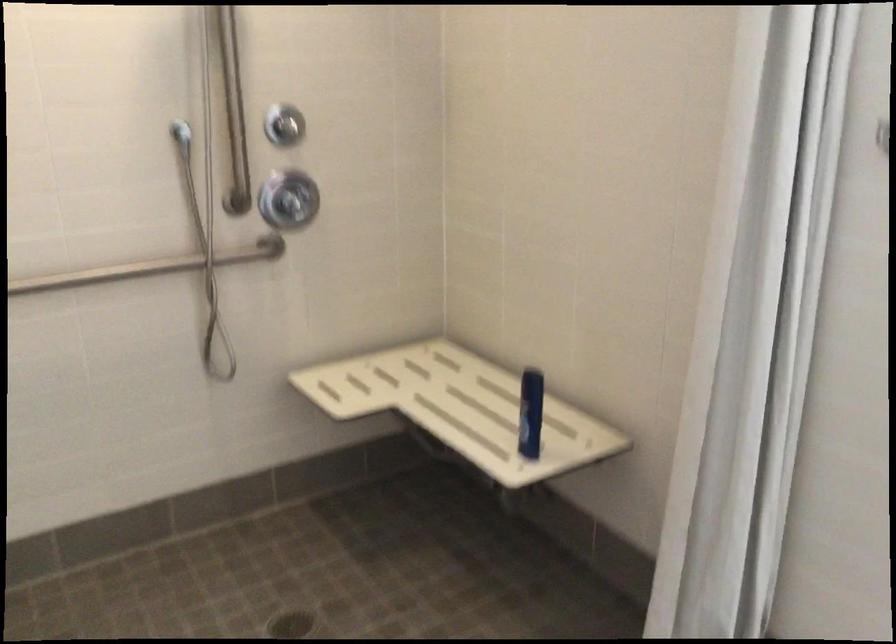
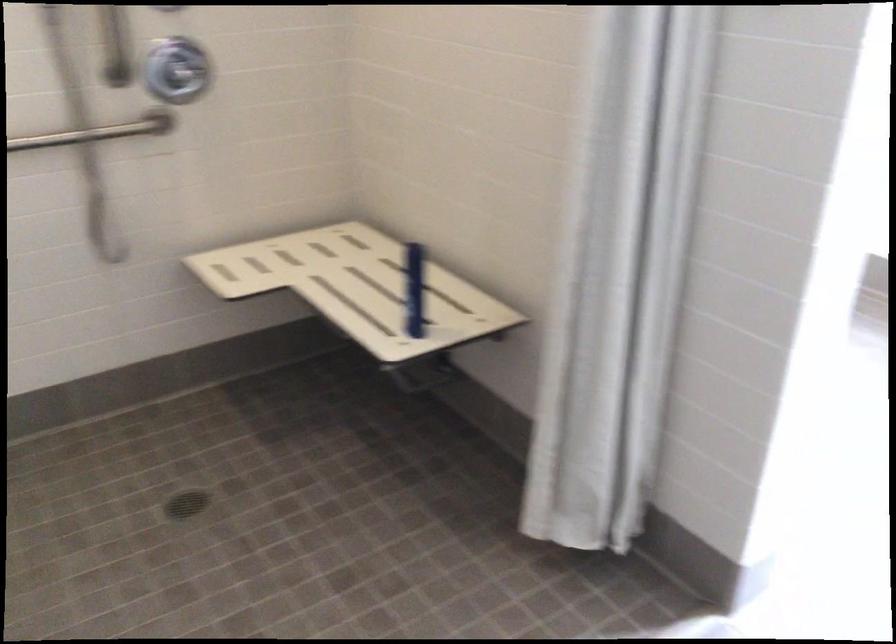
Where in the second image is the point corresponding to point (532, 413) from the first image?

(414, 289)